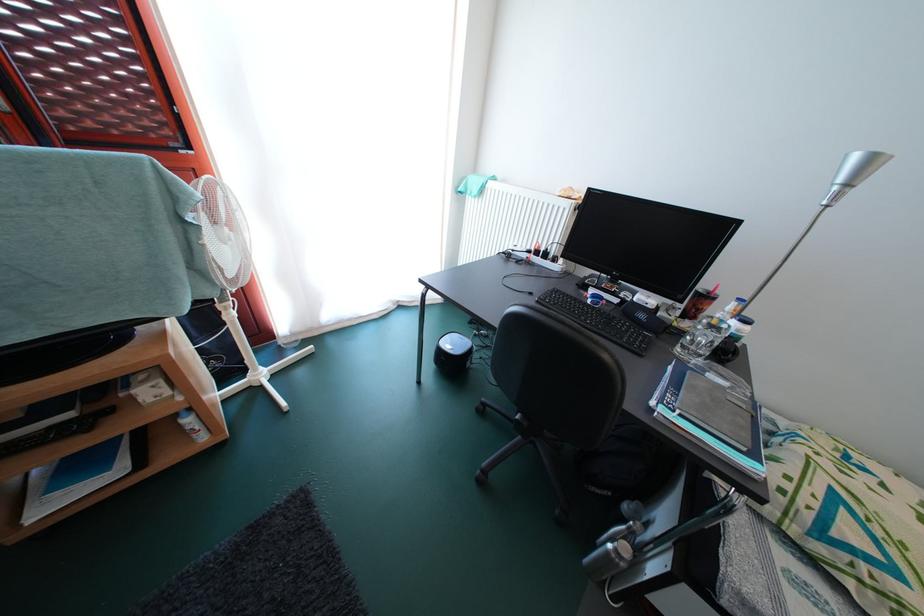
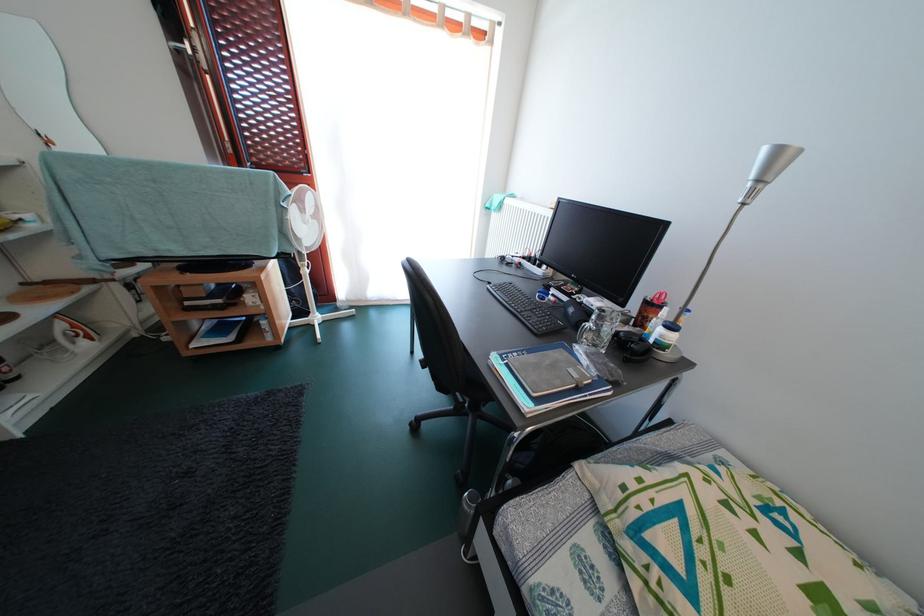
Locate, in the second image, the point that corresponds to pixel 544 308 in the first image.

(495, 294)